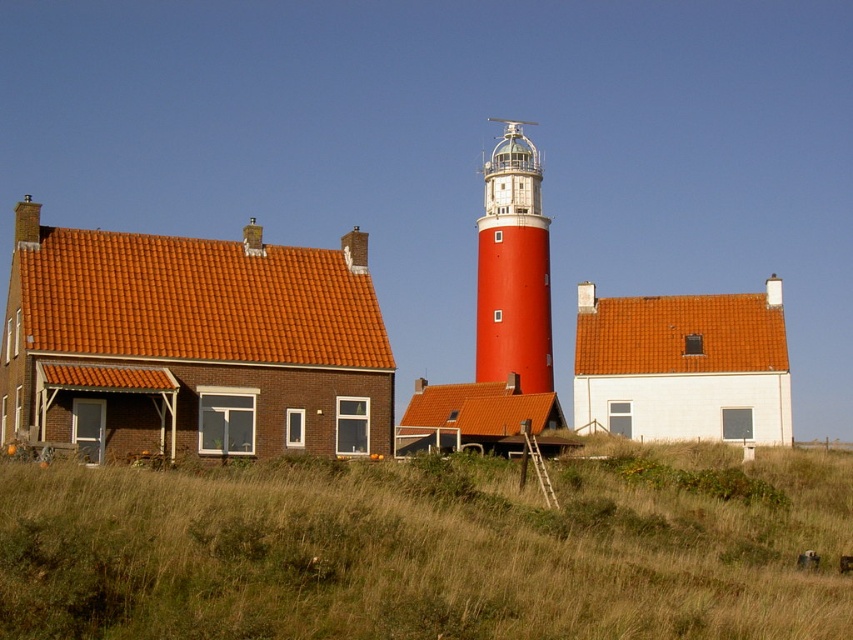
You are a drone operator who needs to fly a drone from the dry grass at center to the smooth red lighthouse at center. What is the minimum distance you need to cover?

The minimum distance between the dry grass at center and the smooth red lighthouse at center is 192.25 feet.

You are standing in the middle of the dry grass at center and want to walk to the smooth red lighthouse at center. Which direction should you move to reach it?

The dry grass at center is to the left of the smooth red lighthouse at center, so you should move to the right to reach it.

You are standing at the base of the lighthouse and want to walk directly towards the white house on the right. Will you step on the dry grass at center before reaching the house?

The dry grass at center is located at point [428,548], so yes, you will step on the dry grass at center before reaching the white house on the right.